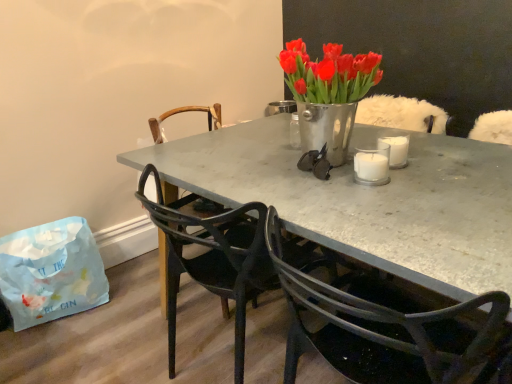
This screenshot has height=384, width=512. Find the location of `vacant point to the right of white paper bag at lower left`. vacant point to the right of white paper bag at lower left is located at coordinates (128, 308).